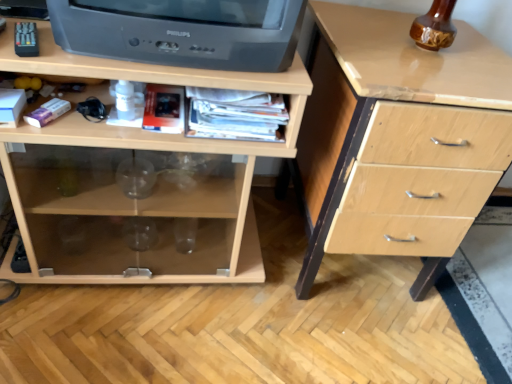
How much space does light wood chest of drawers at right, the 2th chest of drawers viewed from the left, occupy horizontally?

light wood chest of drawers at right, the 2th chest of drawers viewed from the left, is 25.47 inches in width.

This screenshot has width=512, height=384. In order to click on black plastic television at upper left in this screenshot , I will do `click(182, 31)`.

Image resolution: width=512 pixels, height=384 pixels. Describe the element at coordinates (156, 188) in the screenshot. I see `light wood chest of drawers at center, arranged as the first chest of drawers when viewed from the left` at that location.

You are a GUI agent. You are given a task and a screenshot of the screen. Output one action in this format:
    pyautogui.click(x=<x>, y=<y>)
    Task: Click on the light wood chest of drawers at center, arranged as the first chest of drawers when viewed from the left
    The width and height of the screenshot is (512, 384).
    Given the screenshot: What is the action you would take?
    (156, 188)

Find the location of a particular element. Image resolution: width=512 pixels, height=384 pixels. light wood chest of drawers at right, which is the 1th chest of drawers from right to left is located at coordinates (376, 103).

Based on the photo, is light wood chest of drawers at center, arranged as the 2th chest of drawers when viewed from the right, at the back of light wood chest of drawers at right, the 2th chest of drawers viewed from the left?

No, light wood chest of drawers at right, the 2th chest of drawers viewed from the left, is not facing away from light wood chest of drawers at center, arranged as the 2th chest of drawers when viewed from the right.

Which object is thinner, light wood chest of drawers at right, which is the 1th chest of drawers from right to left, or light wood chest of drawers at center, arranged as the 2th chest of drawers when viewed from the right?

With smaller width is light wood chest of drawers at center, arranged as the 2th chest of drawers when viewed from the right.

From the image's perspective, between light wood chest of drawers at right, the 2th chest of drawers viewed from the left, and light wood chest of drawers at center, arranged as the 2th chest of drawers when viewed from the right, which one is located above?

light wood chest of drawers at center, arranged as the 2th chest of drawers when viewed from the right.

Based on the photo, in the image, is light wood chest of drawers at right, which is the 1th chest of drawers from right to left, on the left side or the right side of light wood chest of drawers at center, arranged as the 2th chest of drawers when viewed from the right?

light wood chest of drawers at right, which is the 1th chest of drawers from right to left, is positioned on light wood chest of drawers at center, arranged as the 2th chest of drawers when viewed from the right,'s right side.

Who is smaller, black plastic television at upper left or light wood chest of drawers at center, arranged as the first chest of drawers when viewed from the left?

black plastic television at upper left.

Can you confirm if black plastic television at upper left is taller than light wood chest of drawers at center, arranged as the 2th chest of drawers when viewed from the right?

No, black plastic television at upper left is not taller than light wood chest of drawers at center, arranged as the 2th chest of drawers when viewed from the right.

Between point (177, 36) and point (12, 193), which one is positioned behind?

The point (12, 193) is farther from the camera.

Does black plastic television at upper left have a lesser width compared to light wood chest of drawers at center, arranged as the 2th chest of drawers when viewed from the right?

Correct, the width of black plastic television at upper left is less than that of light wood chest of drawers at center, arranged as the 2th chest of drawers when viewed from the right.

From a real-world perspective, who is located higher, light wood chest of drawers at right, the 2th chest of drawers viewed from the left, or black plastic television at upper left?

black plastic television at upper left is physically above.

Is light wood chest of drawers at right, which is the 1th chest of drawers from right to left, oriented towards black plastic television at upper left?

No, light wood chest of drawers at right, which is the 1th chest of drawers from right to left, is not facing towards black plastic television at upper left.

Is light wood chest of drawers at right, which is the 1th chest of drawers from right to left, placed right next to black plastic television at upper left?

No, light wood chest of drawers at right, which is the 1th chest of drawers from right to left, is not in contact with black plastic television at upper left.

From a real-world perspective, is black plastic television at upper left located beneath light wood chest of drawers at right, the 2th chest of drawers viewed from the left?

No.

Considering the relative sizes of black plastic television at upper left and light wood chest of drawers at right, the 2th chest of drawers viewed from the left, in the image provided, is black plastic television at upper left taller than light wood chest of drawers at right, the 2th chest of drawers viewed from the left,?

No.

Are black plastic television at upper left and light wood chest of drawers at right, the 2th chest of drawers viewed from the left, making contact?

They are not placed beside each other.

Looking at their sizes, would you say light wood chest of drawers at center, arranged as the first chest of drawers when viewed from the left, is wider or thinner than light wood chest of drawers at right, the 2th chest of drawers viewed from the left?

Clearly, light wood chest of drawers at center, arranged as the first chest of drawers when viewed from the left, has less width compared to light wood chest of drawers at right, the 2th chest of drawers viewed from the left.

From a real-world perspective, is light wood chest of drawers at center, arranged as the first chest of drawers when viewed from the left, on top of light wood chest of drawers at right, which is the 1th chest of drawers from right to left?

No, from a real-world perspective, light wood chest of drawers at center, arranged as the first chest of drawers when viewed from the left, is not above light wood chest of drawers at right, which is the 1th chest of drawers from right to left.

Is light wood chest of drawers at center, arranged as the first chest of drawers when viewed from the left, further to the viewer compared to light wood chest of drawers at right, the 2th chest of drawers viewed from the left?

No.

Does light wood chest of drawers at center, arranged as the 2th chest of drawers when viewed from the right, appear on the left side of light wood chest of drawers at right, which is the 1th chest of drawers from right to left?

Correct, you'll find light wood chest of drawers at center, arranged as the 2th chest of drawers when viewed from the right, to the left of light wood chest of drawers at right, which is the 1th chest of drawers from right to left.

Who is bigger, light wood chest of drawers at center, arranged as the first chest of drawers when viewed from the left, or black plastic television at upper left?

light wood chest of drawers at center, arranged as the first chest of drawers when viewed from the left.

Between point (108, 263) and point (244, 41), which one is positioned in front?

The point (244, 41) is closer.

Would you say light wood chest of drawers at center, arranged as the 2th chest of drawers when viewed from the right, is inside or outside black plastic television at upper left?

The correct answer is: outside.

From the black plastic television at upper left, count 1st chest of drawerss backward and point to it. Please provide its 2D coordinates.

[(156, 188)]

Find the location of `chest of drawers behind the light wood chest of drawers at center, arranged as the first chest of drawers when viewed from the left`. chest of drawers behind the light wood chest of drawers at center, arranged as the first chest of drawers when viewed from the left is located at coordinates (376, 103).

Locate an element on the screen. The width and height of the screenshot is (512, 384). the chest of drawers that is the 2nd one below the black plastic television at upper left (from a real-world perspective) is located at coordinates (156, 188).

Based on their spatial positions, is light wood chest of drawers at right, which is the 1th chest of drawers from right to left, or black plastic television at upper left closer to light wood chest of drawers at center, arranged as the 2th chest of drawers when viewed from the right?

Based on the image, black plastic television at upper left appears to be nearer to light wood chest of drawers at center, arranged as the 2th chest of drawers when viewed from the right.

Which object lies further to the anchor point light wood chest of drawers at right, which is the 1th chest of drawers from right to left, light wood chest of drawers at center, arranged as the 2th chest of drawers when viewed from the right, or black plastic television at upper left?

The object further to light wood chest of drawers at right, which is the 1th chest of drawers from right to left, is black plastic television at upper left.

Looking at the image, which one is located further to light wood chest of drawers at center, arranged as the first chest of drawers when viewed from the left, black plastic television at upper left or light wood chest of drawers at right, the 2th chest of drawers viewed from the left?

light wood chest of drawers at right, the 2th chest of drawers viewed from the left, is positioned further to the anchor light wood chest of drawers at center, arranged as the first chest of drawers when viewed from the left.

Which object lies further to the anchor point black plastic television at upper left, light wood chest of drawers at center, arranged as the 2th chest of drawers when viewed from the right, or light wood chest of drawers at right, the 2th chest of drawers viewed from the left?

Among the two, light wood chest of drawers at right, the 2th chest of drawers viewed from the left, is located further to black plastic television at upper left.

Which object lies further to the anchor point light wood chest of drawers at right, the 2th chest of drawers viewed from the left, black plastic television at upper left or light wood chest of drawers at center, arranged as the first chest of drawers when viewed from the left?

black plastic television at upper left lies further to light wood chest of drawers at right, the 2th chest of drawers viewed from the left, than the other object.

Looking at the image, which one is located further to black plastic television at upper left, light wood chest of drawers at right, which is the 1th chest of drawers from right to left, or light wood chest of drawers at center, arranged as the first chest of drawers when viewed from the left?

light wood chest of drawers at right, which is the 1th chest of drawers from right to left, is further to black plastic television at upper left.

The width and height of the screenshot is (512, 384). In order to click on television between light wood chest of drawers at center, arranged as the first chest of drawers when viewed from the left, and light wood chest of drawers at right, the 2th chest of drawers viewed from the left, from left to right in this screenshot , I will do (x=182, y=31).